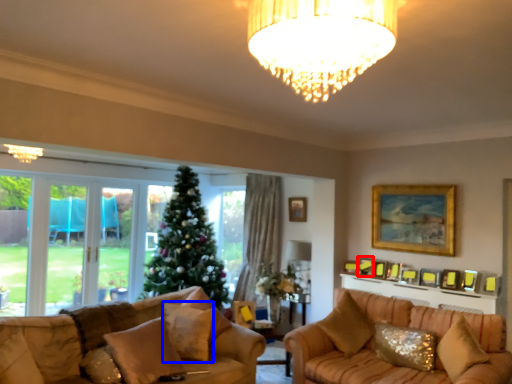
Question: Which object appears farthest to the camera in this image, picture frame (highlighted by a red box) or pillow (highlighted by a blue box)?

Choices:
 (A) picture frame
 (B) pillow

Answer: (A)